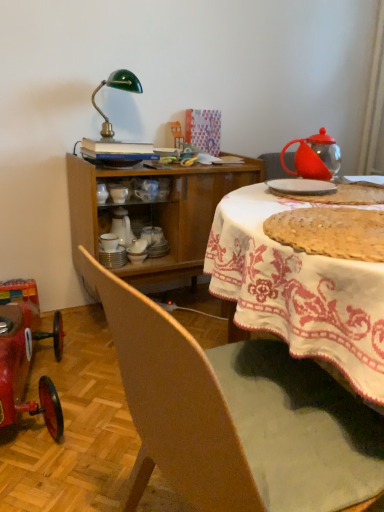
Question: Is golden crumbly pie at center smaller than white ceramic plates at center, positioned as the 2th tableware in back-to-front order?

Choices:
 (A) no
 (B) yes

Answer: (A)

Question: Can you confirm if golden crumbly pie at center is thinner than white ceramic plates at center, the fourth tableware viewed from the right?

Choices:
 (A) yes
 (B) no

Answer: (B)

Question: Is golden crumbly pie at center at the right side of white ceramic plates at center, the fourth tableware viewed from the right?

Choices:
 (A) yes
 (B) no

Answer: (A)

Question: Considering the relative sizes of golden crumbly pie at center and white ceramic plates at center, the 1th tableware viewed from the left, in the image provided, is golden crumbly pie at center wider than white ceramic plates at center, the 1th tableware viewed from the left,?

Choices:
 (A) no
 (B) yes

Answer: (B)

Question: Does golden crumbly pie at center have a larger size compared to white ceramic plates at center, the fourth tableware viewed from the right?

Choices:
 (A) yes
 (B) no

Answer: (A)

Question: Is point (354, 406) closer or farther from the camera than point (29, 357)?

Choices:
 (A) farther
 (B) closer

Answer: (B)

Question: Is wooden chair at lower left in front of or behind shiny red toy car at lower left in the image?

Choices:
 (A) behind
 (B) front

Answer: (B)

Question: Is wooden chair at lower left bigger or smaller than shiny red toy car at lower left?

Choices:
 (A) small
 (B) big

Answer: (B)

Question: Looking at their shapes, would you say wooden chair at lower left is wider or thinner than shiny red toy car at lower left?

Choices:
 (A) wide
 (B) thin

Answer: (B)

Question: In terms of width, does wooden cabinet at center look wider or thinner when compared to shiny red toy car at lower left?

Choices:
 (A) thin
 (B) wide

Answer: (A)

Question: From a real-world perspective, is wooden cabinet at center physically located above or below shiny red toy car at lower left?

Choices:
 (A) above
 (B) below

Answer: (A)

Question: Is wooden cabinet at center inside or outside of shiny red toy car at lower left?

Choices:
 (A) outside
 (B) inside

Answer: (A)

Question: From the image's perspective, relative to shiny red toy car at lower left, is wooden cabinet at center above or below?

Choices:
 (A) above
 (B) below

Answer: (A)

Question: Is point (67, 175) closer or farther from the camera than point (306, 227)?

Choices:
 (A) farther
 (B) closer

Answer: (A)

Question: From a real-world perspective, is wooden cabinet at center above or below golden crumbly pie at center?

Choices:
 (A) below
 (B) above

Answer: (A)